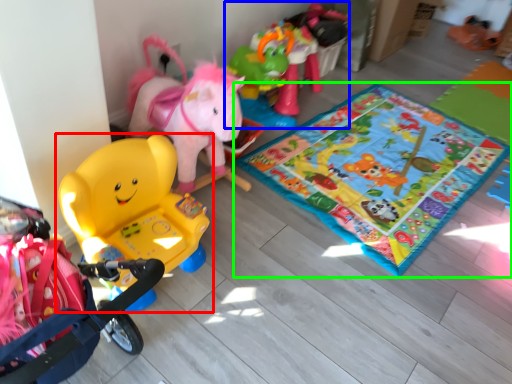
Question: Considering the real-world distances, which object is closest to toy (highlighted by a red box)? toy (highlighted by a blue box) or yoga mat (highlighted by a green box).

Choices:
 (A) toy
 (B) yoga mat

Answer: (B)